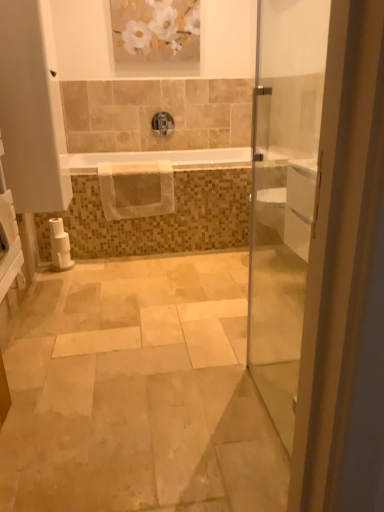
In order to click on unoccupied region to the right of white matte toilet paper at lower left in this screenshot , I will do `click(94, 265)`.